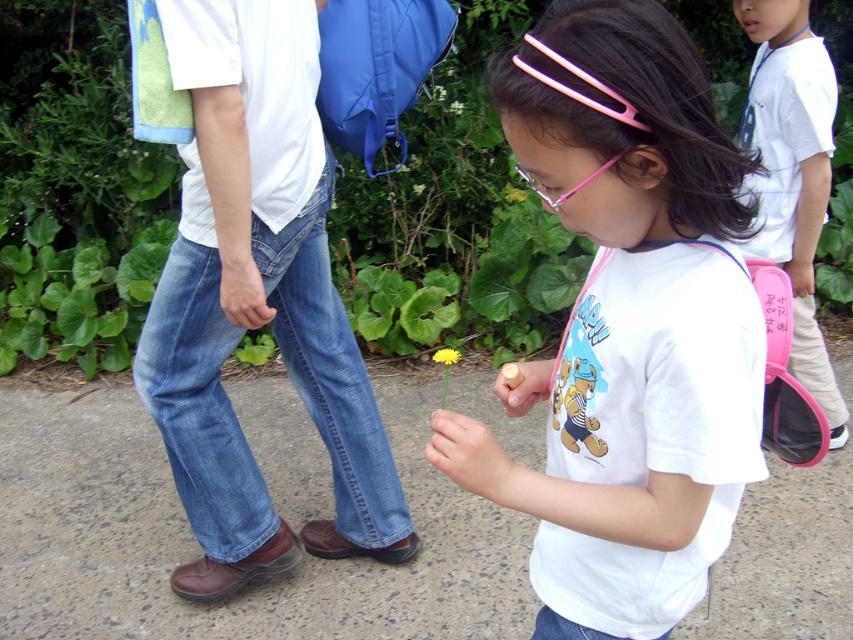
What object is located at the coordinates point (445,365)?

The yellow matte dandelion at center is located at point (445,365).

From the picture: You are a photographer trying to capture the girl with the pink plastic hair clip at upper center. The camera you are using has a focus point at coordinate point (577, 92). Will this focus point help you capture the pink plastic hair clip at upper center clearly?

The pink plastic hair clip at upper center is represented by point (577, 92), so yes, the focus point at coordinate point (577, 92) will help capture the pink plastic hair clip at upper center clearly.

You are a photographer trying to capture the yellow matte dandelion at center and the yellow matte flower at center in the same frame. Based on their positions, which one is closer to the bottom of the image?

The yellow matte dandelion at center is below the yellow matte flower at center, so it is closer to the bottom of the image.